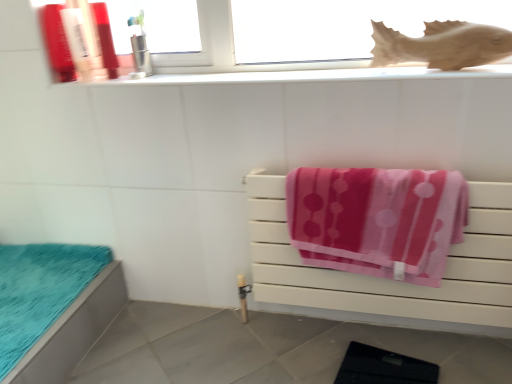
The width and height of the screenshot is (512, 384). What do you see at coordinates (105, 38) in the screenshot?
I see `shiny plastic toothbrush at upper left, positioned as the third toiletry in left-to-right order` at bounding box center [105, 38].

Describe the element at coordinates (377, 219) in the screenshot. I see `pink soft towel at center right` at that location.

The image size is (512, 384). Find the location of `matte plastic bottle at upper left, acting as the 4th toiletry starting from the right`. matte plastic bottle at upper left, acting as the 4th toiletry starting from the right is located at coordinates (57, 42).

What do you see at coordinates (57, 42) in the screenshot? I see `matte plastic bottle at upper left, acting as the 4th toiletry starting from the right` at bounding box center [57, 42].

Find the location of a particular element. The image size is (512, 384). teal fabric bed at lower left is located at coordinates (54, 307).

The width and height of the screenshot is (512, 384). Describe the element at coordinates (309, 76) in the screenshot. I see `white glossy window sill at upper center` at that location.

I want to click on pink fabric towel at center, so click(x=388, y=279).

This screenshot has height=384, width=512. I want to click on towel on the right of the white glossy window sill at upper center, so click(377, 219).

Is pink soft towel at center right inside the boundaries of white glossy window sill at upper center, or outside?

pink soft towel at center right is not inside white glossy window sill at upper center, it's outside.

Is pink soft towel at center right looking in the opposite direction of white glossy window sill at upper center?

pink soft towel at center right does not have its back to white glossy window sill at upper center.

From the image's perspective, is pink soft towel at center right positioned above or below white glossy window sill at upper center?

Clearly, from the image's perspective, pink soft towel at center right is below white glossy window sill at upper center.

Is transparent glass window at upper center positioned behind brown matte fish at upper right?

Yes, it is behind brown matte fish at upper right.

Which is correct: transparent glass window at upper center is inside brown matte fish at upper right, or outside of it?

transparent glass window at upper center cannot be found inside brown matte fish at upper right.

Based on the photo, are transparent glass window at upper center and brown matte fish at upper right far apart?

Actually, transparent glass window at upper center and brown matte fish at upper right are a little close together.

Considering the relative positions of pink soft towel at center right and metallic toothbrush holder at upper left, arranged as the 4th toiletry when viewed from the left, in the image provided, is pink soft towel at center right to the left of metallic toothbrush holder at upper left, arranged as the 4th toiletry when viewed from the left, from the viewer's perspective?

Incorrect, pink soft towel at center right is not on the left side of metallic toothbrush holder at upper left, arranged as the 4th toiletry when viewed from the left.

Does point (341, 219) come in front of point (142, 13)?

Yes, point (341, 219) is in front of point (142, 13).

In terms of height, does pink soft towel at center right look taller or shorter compared to metallic toothbrush holder at upper left, arranged as the 4th toiletry when viewed from the left?

pink soft towel at center right is taller than metallic toothbrush holder at upper left, arranged as the 4th toiletry when viewed from the left.

Which object is closer to the camera taking this photo, pink soft towel at center right or metallic toothbrush holder at upper left, marked as the first toiletry in a right-to-left arrangement?

pink soft towel at center right.

Is metallic toothbrush holder at upper left, arranged as the 4th toiletry when viewed from the left, oriented towards matte plastic bottle at upper left, acting as the 4th toiletry starting from the right?

No, metallic toothbrush holder at upper left, arranged as the 4th toiletry when viewed from the left, is not facing towards matte plastic bottle at upper left, acting as the 4th toiletry starting from the right.

Based on their positions, is metallic toothbrush holder at upper left, arranged as the 4th toiletry when viewed from the left, located to the left or right of matte plastic bottle at upper left, acting as the 4th toiletry starting from the right?

In the image, metallic toothbrush holder at upper left, arranged as the 4th toiletry when viewed from the left, appears on the right side of matte plastic bottle at upper left, acting as the 4th toiletry starting from the right.

Considering the positions of objects metallic toothbrush holder at upper left, arranged as the 4th toiletry when viewed from the left, and matte plastic bottle at upper left, the first toiletry when ordered from left to right, in the image provided, who is behind, metallic toothbrush holder at upper left, arranged as the 4th toiletry when viewed from the left, or matte plastic bottle at upper left, the first toiletry when ordered from left to right,?

metallic toothbrush holder at upper left, arranged as the 4th toiletry when viewed from the left, is behind.

From their relative heights in the image, would you say metallic toothbrush holder at upper left, marked as the first toiletry in a right-to-left arrangement, is taller or shorter than matte plastic bottle at upper left, the first toiletry when ordered from left to right?

Clearly, metallic toothbrush holder at upper left, marked as the first toiletry in a right-to-left arrangement, is taller compared to matte plastic bottle at upper left, the first toiletry when ordered from left to right.

Does brown matte fish at upper right have a smaller size compared to matte plastic bottle at upper left, the first toiletry when ordered from left to right?

Actually, brown matte fish at upper right might be larger than matte plastic bottle at upper left, the first toiletry when ordered from left to right.

From the image's perspective, does brown matte fish at upper right appear higher than matte plastic bottle at upper left, acting as the 4th toiletry starting from the right?

No.

Is brown matte fish at upper right to the left of matte plastic bottle at upper left, acting as the 4th toiletry starting from the right, from the viewer's perspective?

Incorrect, brown matte fish at upper right is not on the left side of matte plastic bottle at upper left, acting as the 4th toiletry starting from the right.

Considering the positions of objects teal fabric bed at lower left and white glossy window sill at upper center in the image provided, who is more to the right, teal fabric bed at lower left or white glossy window sill at upper center?

white glossy window sill at upper center.

In terms of width, does teal fabric bed at lower left look wider or thinner when compared to white glossy window sill at upper center?

Clearly, teal fabric bed at lower left has more width compared to white glossy window sill at upper center.

Could you tell me if teal fabric bed at lower left is turned towards white glossy window sill at upper center?

No.

What's the angular difference between teal fabric bed at lower left and white glossy window sill at upper center's facing directions?

The angle between the facing direction of teal fabric bed at lower left and the facing direction of white glossy window sill at upper center is 90.7 degrees.

Looking at this image, how many degrees apart are the facing directions of white glossy window sill at upper center and metallic toothbrush holder at upper left, arranged as the 4th toiletry when viewed from the left?

90.3 degrees separate the facing orientations of white glossy window sill at upper center and metallic toothbrush holder at upper left, arranged as the 4th toiletry when viewed from the left.

Who is bigger, white glossy window sill at upper center or metallic toothbrush holder at upper left, arranged as the 4th toiletry when viewed from the left?

With larger size is white glossy window sill at upper center.

Which object is closer to the camera taking this photo, white glossy window sill at upper center or metallic toothbrush holder at upper left, marked as the first toiletry in a right-to-left arrangement?

white glossy window sill at upper center is closer to the camera.

From the white glossy window sill at upper center, count the 1st toiletry to the left and point to it. Please provide its 2D coordinates.

[(139, 44)]

What are the coordinates of `towel on the right of white glossy window sill at upper center` in the screenshot? It's located at (377, 219).

Find the location of a particular element. This screenshot has width=512, height=384. window behind the brown matte fish at upper right is located at coordinates (227, 49).

When comparing their distances from pink soft towel at center right, does metallic toothbrush holder at upper left, marked as the first toiletry in a right-to-left arrangement, or matte plastic bottle at upper left, marked as the 2th toiletry in a left-to-right arrangement, seem closer?

The object closer to pink soft towel at center right is metallic toothbrush holder at upper left, marked as the first toiletry in a right-to-left arrangement.

Looking at the image, which one is located closer to shiny plastic toothbrush at upper left, positioned as the third toiletry in left-to-right order, matte plastic bottle at upper left, the first toiletry when ordered from left to right, or white glossy window sill at upper center?

Among the two, matte plastic bottle at upper left, the first toiletry when ordered from left to right, is located nearer to shiny plastic toothbrush at upper left, positioned as the third toiletry in left-to-right order.

Based on their spatial positions, is transparent glass window at upper center or pink soft towel at center right closer to shiny plastic toothbrush at upper left, positioned as the third toiletry in left-to-right order?

The object closer to shiny plastic toothbrush at upper left, positioned as the third toiletry in left-to-right order, is transparent glass window at upper center.

Based on their spatial positions, is brown matte fish at upper right or transparent glass window at upper center closer to matte plastic bottle at upper left, marked as the third toiletry in a right-to-left arrangement?

Among the two, transparent glass window at upper center is located nearer to matte plastic bottle at upper left, marked as the third toiletry in a right-to-left arrangement.

Estimate the real-world distances between objects in this image. Which object is closer to transparent glass window at upper center, brown matte fish at upper right or white glossy window sill at upper center?

The object closer to transparent glass window at upper center is white glossy window sill at upper center.

Looking at the image, which one is located closer to matte plastic bottle at upper left, marked as the 2th toiletry in a left-to-right arrangement, white glossy window sill at upper center or pink soft towel at center right?

The object closer to matte plastic bottle at upper left, marked as the 2th toiletry in a left-to-right arrangement, is white glossy window sill at upper center.

Which object lies further to the anchor point pink soft towel at center right, white glossy window sill at upper center or matte plastic bottle at upper left, marked as the third toiletry in a right-to-left arrangement?

Based on the image, matte plastic bottle at upper left, marked as the third toiletry in a right-to-left arrangement, appears to be further to pink soft towel at center right.

Considering their positions, is metallic toothbrush holder at upper left, marked as the first toiletry in a right-to-left arrangement, positioned further to matte plastic bottle at upper left, acting as the 4th toiletry starting from the right, than shiny plastic toothbrush at upper left, which ranks as the second toiletry in right-to-left order?

The object further to matte plastic bottle at upper left, acting as the 4th toiletry starting from the right, is metallic toothbrush holder at upper left, marked as the first toiletry in a right-to-left arrangement.

Where is `window sill between shiny plastic toothbrush at upper left, positioned as the third toiletry in left-to-right order, and transparent glass window at upper center, in the horizontal direction`? The height and width of the screenshot is (384, 512). window sill between shiny plastic toothbrush at upper left, positioned as the third toiletry in left-to-right order, and transparent glass window at upper center, in the horizontal direction is located at coordinates (309, 76).

Where is `window between matte plastic bottle at upper left, marked as the 2th toiletry in a left-to-right arrangement, and pink soft towel at center right, in the horizontal direction`? The image size is (512, 384). window between matte plastic bottle at upper left, marked as the 2th toiletry in a left-to-right arrangement, and pink soft towel at center right, in the horizontal direction is located at coordinates (227, 49).

This screenshot has width=512, height=384. Find the location of `window between metallic toothbrush holder at upper left, arranged as the 4th toiletry when viewed from the left, and teal fabric bed at lower left in the up-down direction`. window between metallic toothbrush holder at upper left, arranged as the 4th toiletry when viewed from the left, and teal fabric bed at lower left in the up-down direction is located at coordinates click(x=227, y=49).

Where is `window sill between matte plastic bottle at upper left, marked as the 2th toiletry in a left-to-right arrangement, and transparent glass window at upper center from left to right`? The width and height of the screenshot is (512, 384). window sill between matte plastic bottle at upper left, marked as the 2th toiletry in a left-to-right arrangement, and transparent glass window at upper center from left to right is located at coordinates (309, 76).